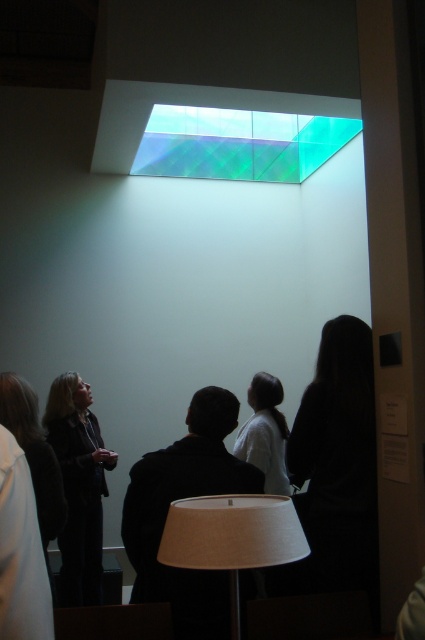
Question: Which object is positioned closest to the white fabric lampshade at lower center?

Choices:
 (A) white matte shirt at center
 (B) dark brown hair at left
 (C) dark brown leather jacket at lower left

Answer: (B)

Question: Which point is closer to the camera taking this photo?

Choices:
 (A) (x=268, y=404)
 (B) (x=169, y=563)

Answer: (B)

Question: Which point is closer to the camera?

Choices:
 (A) (93, 493)
 (B) (257, 381)
 (C) (170, 513)
 (D) (53, 516)

Answer: (C)

Question: Does white fabric lampshade at lower center appear on the right side of white matte shirt at center?

Choices:
 (A) no
 (B) yes

Answer: (A)

Question: Is white fabric lampshade at lower center further to camera compared to dark brown hair at left?

Choices:
 (A) yes
 (B) no

Answer: (B)

Question: Is the position of dark brown hair at left less distant than that of white matte shirt at center?

Choices:
 (A) yes
 (B) no

Answer: (A)